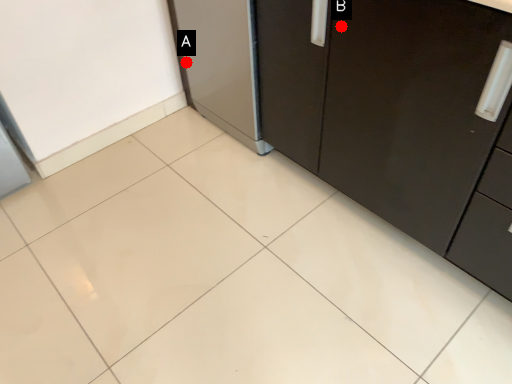
Question: Two points are circled on the image, labeled by A and B beside each circle. Which point is farther from the camera taking this photo?

Choices:
 (A) A is further
 (B) B is further

Answer: (A)